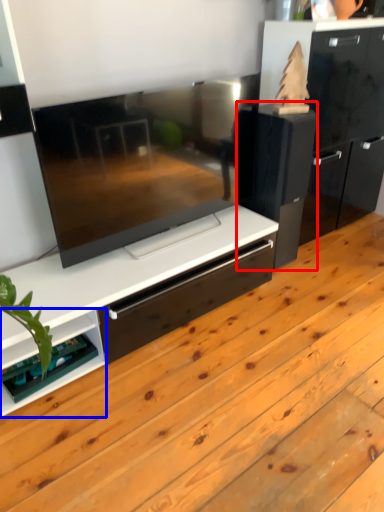
Question: Among these objects, which one is nearest to the camera, appliance (highlighted by a red box) or shelf (highlighted by a blue box)?

Choices:
 (A) appliance
 (B) shelf

Answer: (B)